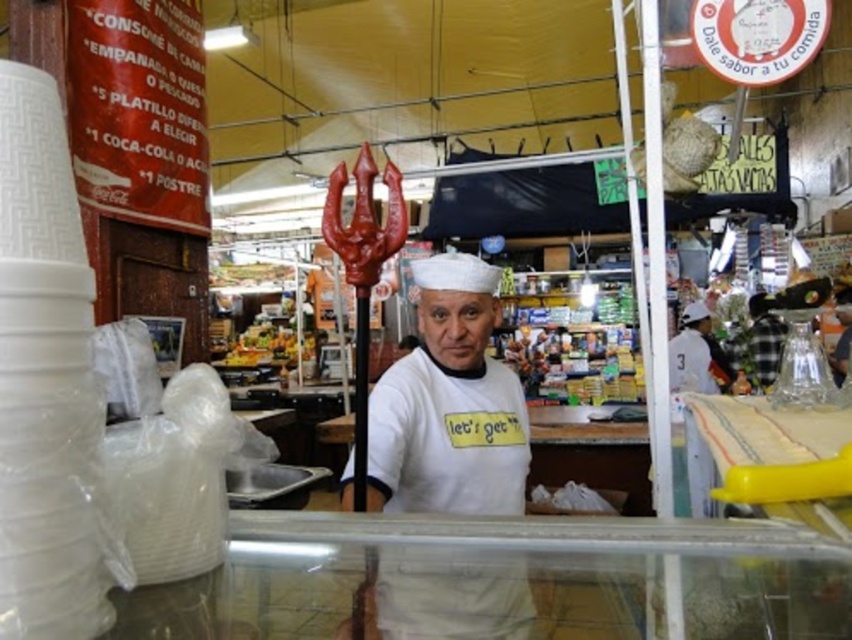
You are a customer at the market and want to locate the chef wearing the white matte chef hat at center. Based on the coordinates provided, where should you look to find the chef?

The white matte chef hat at center is located at coordinates point [448,404], so you should look towards the center of the image slightly to the right and lower middle area to find the chef.

You are a customer at this market stall. You notice the white matte chef hat at center and the shiny plastic fruits at center. Which object is positioned higher in the image?

The white matte chef hat at center is positioned higher than the shiny plastic fruits at center in the image.

In the market scene, you see the white matte chef hat at center and the shiny plastic fruits at center. Which object is positioned to the right?

The white matte chef hat at center is to the right of the shiny plastic fruits at center.